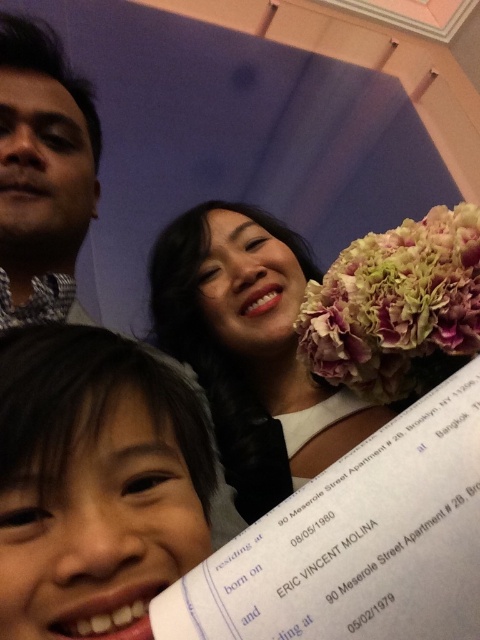
Question: Among these objects, which one is nearest to the camera?

Choices:
 (A) smooth white dress at center
 (B) smooth skin face at lower left

Answer: (B)

Question: Is smooth white dress at center wider than matte black shirt at upper left?

Choices:
 (A) no
 (B) yes

Answer: (B)

Question: Estimate the real-world distances between objects in this image. Which object is farther from the smooth skin face at lower left?

Choices:
 (A) smooth white dress at center
 (B) matte black shirt at upper left

Answer: (A)

Question: Estimate the real-world distances between objects in this image. Which object is farther from the pink matte flower at right?

Choices:
 (A) smooth white dress at center
 (B) smooth skin face at lower left
 (C) matte black shirt at upper left

Answer: (C)

Question: Can you confirm if pink matte flower at right is positioned below matte black shirt at upper left?

Choices:
 (A) yes
 (B) no

Answer: (A)

Question: Does pink matte flower at right have a greater width compared to matte black shirt at upper left?

Choices:
 (A) no
 (B) yes

Answer: (B)